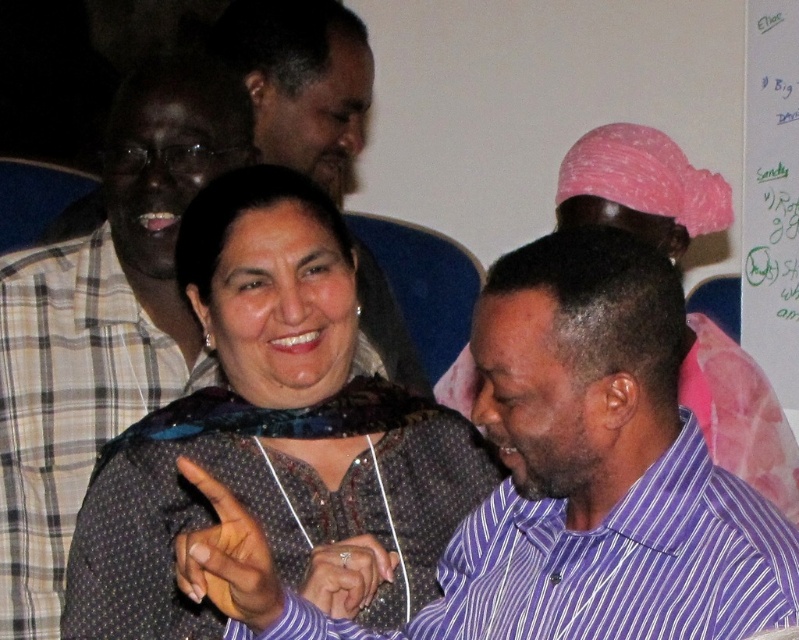
You are organizing a photo album and want to place the purple striped shirt at lower right and the white paper at upper right in the correct spatial arrangement. Based on the scene description, which object is positioned to the left of the other?

The purple striped shirt at lower right is to the left of white paper at upper right.